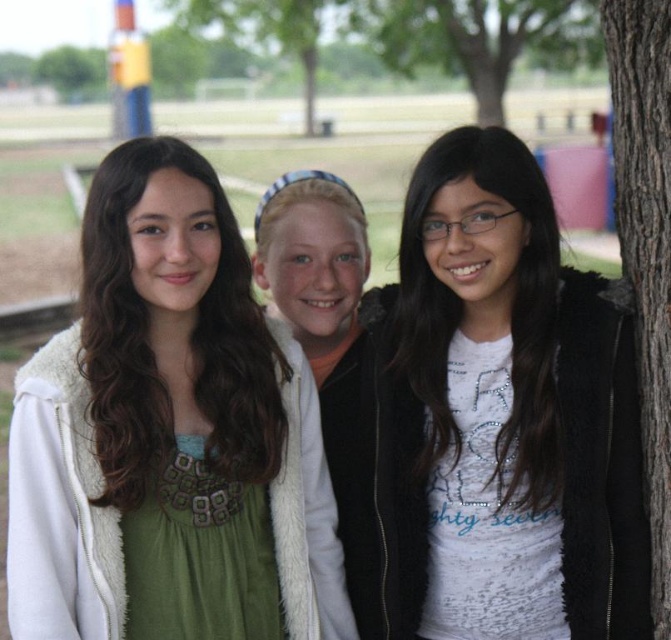
You are trying to decide which clothing item to choose for a photoshoot. You see the green fabric dress at center and the white matte jacket at center. Which one is shorter in height?

The green fabric dress at center is shorter in height compared to the white matte jacket at center.